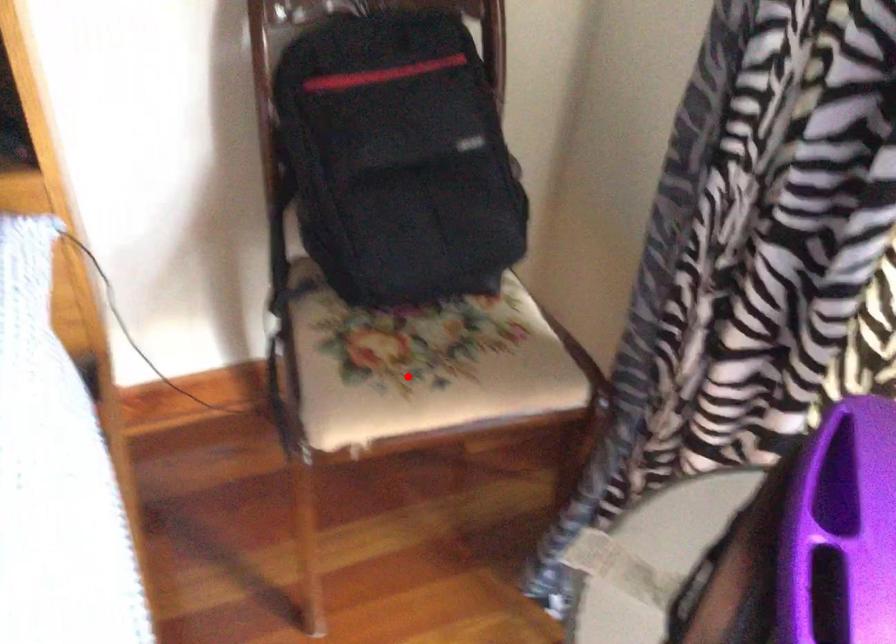
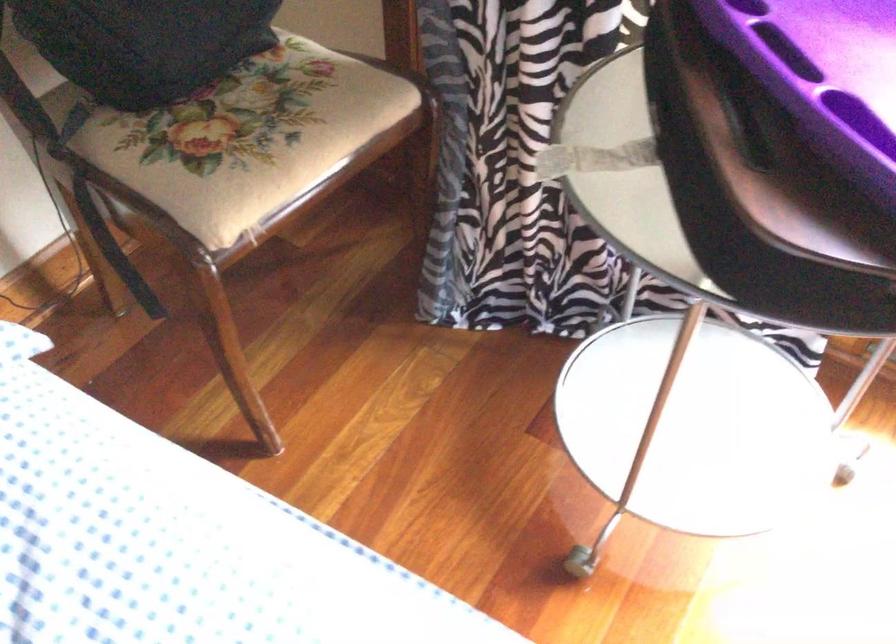
The point at the highlighted location is marked in the first image. Where is the corresponding point in the second image?

(259, 145)